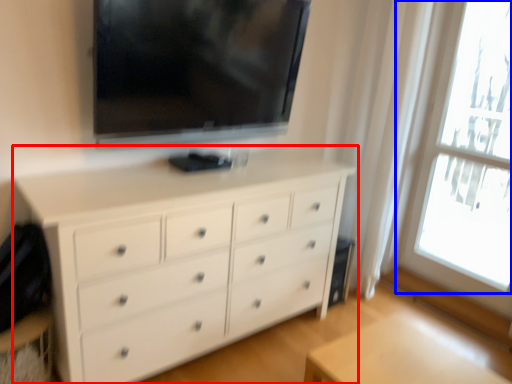
Question: Which object is closer to the camera taking this photo, chest of drawers (highlighted by a red box) or window (highlighted by a blue box)?

Choices:
 (A) chest of drawers
 (B) window

Answer: (A)